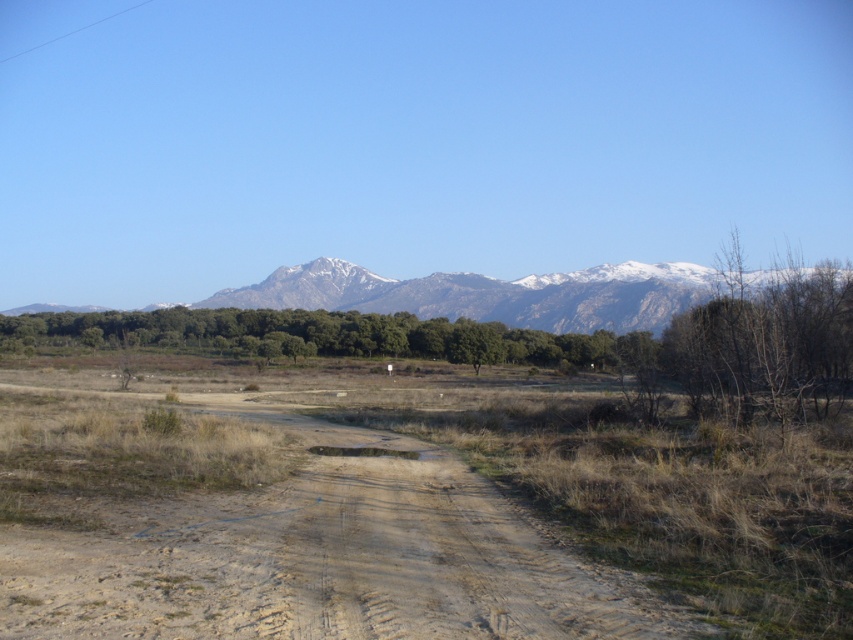
You are a hiker planning to walk along the brown sandy dirt track at center. You notice the snowy granite mountain range at upper center in the background. Which of these two features is wider from your current viewpoint?

The brown sandy dirt track at center is narrower than the snowy granite mountain range at upper center, so the mountain range is wider from your current viewpoint.

You are standing at the starting point of the dirt road in the rural landscape. You see two points marked on the road ahead. The first is at point (x=227, y=552) and the second is at point (x=369, y=301). Which point is closer to you along the road?

Point (x=227, y=552) is closer to you because it is in front of point (x=369, y=301) along the road.

You are a hiker planning to walk along the brown sandy dirt track at center. You want to know if the snowy granite mountain range at upper center will be visible while walking on the track. Based on the scene description, can you confirm if the mountain range is above the dirt track?

The brown sandy dirt track at center is below the snowy granite mountain range at upper center, so yes, the mountain range is above the dirt track and should be visible while walking on it.